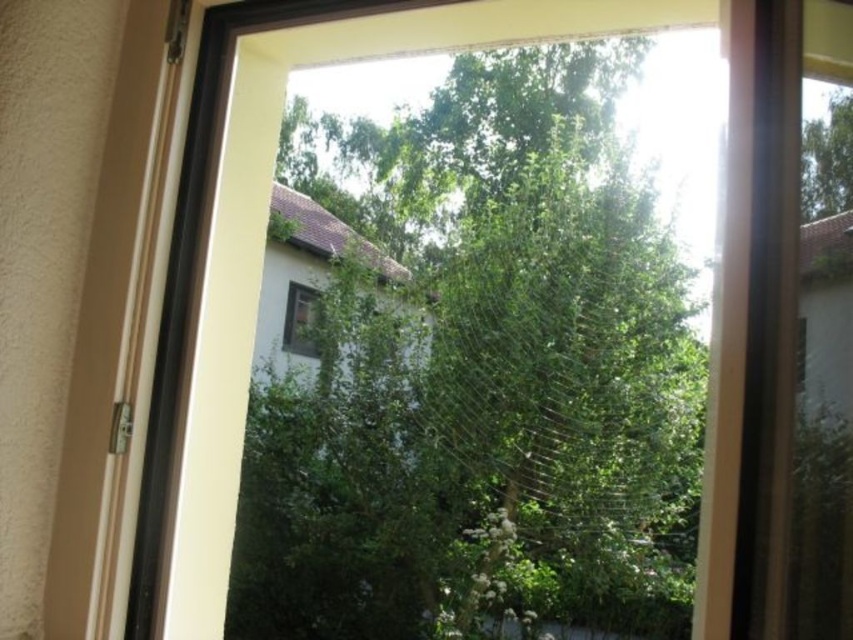
Consider the image. You are an interior designer assessing the view from the window. The matte white window at center is 30 cm wide. Can you determine if the green leafy tree at center would fit through the window if it were to be moved indoors?

The green leafy tree at center is wider than the matte white window at center, which is 30 cm wide. Therefore, the tree cannot fit through the window.